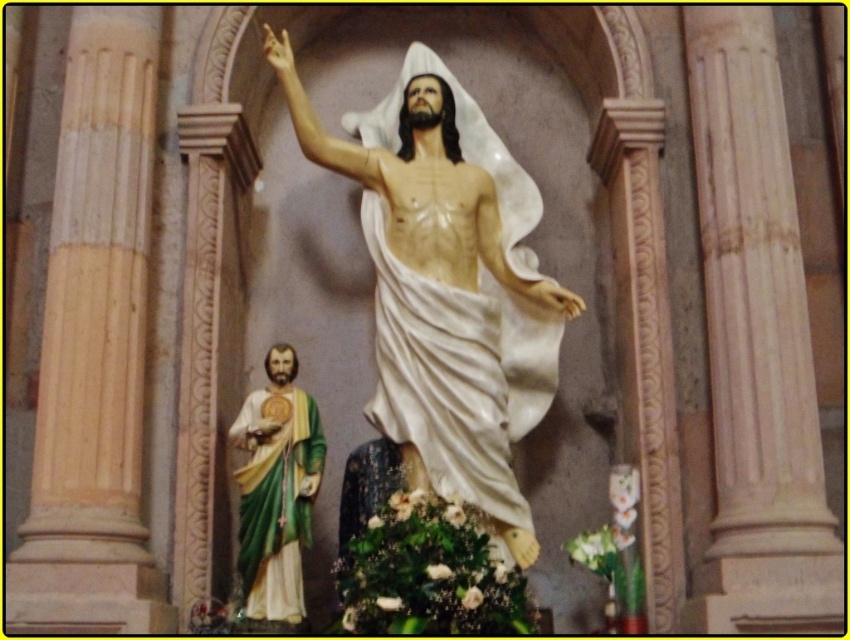
You are an art conservator assessing the spatial arrangement of statues in a church. You notice the white marble statue at center and the green painted wood statue at left. Based on their positioning, which one is closer to the entrance of the church?

The white marble statue at center is closer to the entrance of the church because the green painted wood statue at left is positioned behind it.

Consider the image. Based on the scene description, which statue is wider, the white marble statue at center or the green painted wood statue at left?

The white marble statue at center is wider than the green painted wood statue at left.